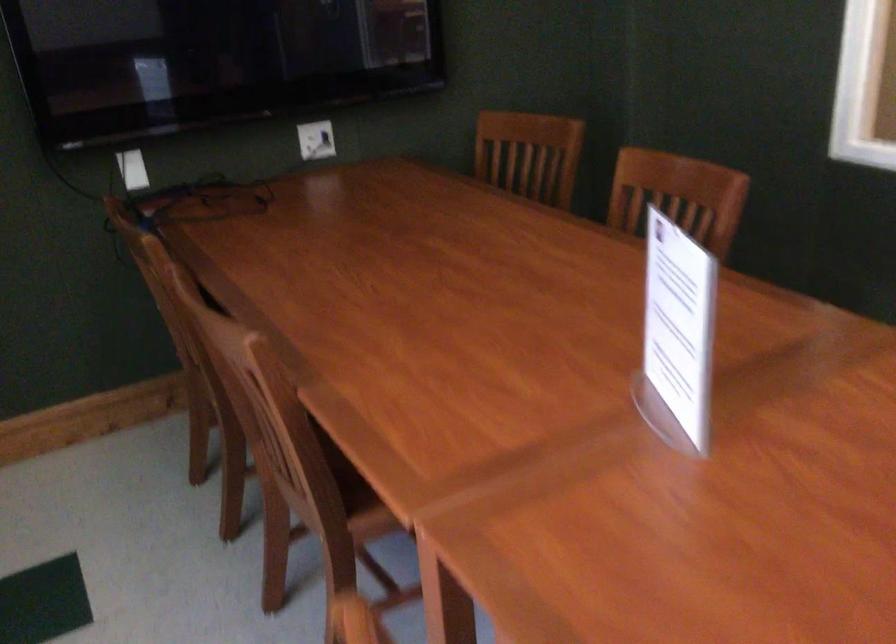
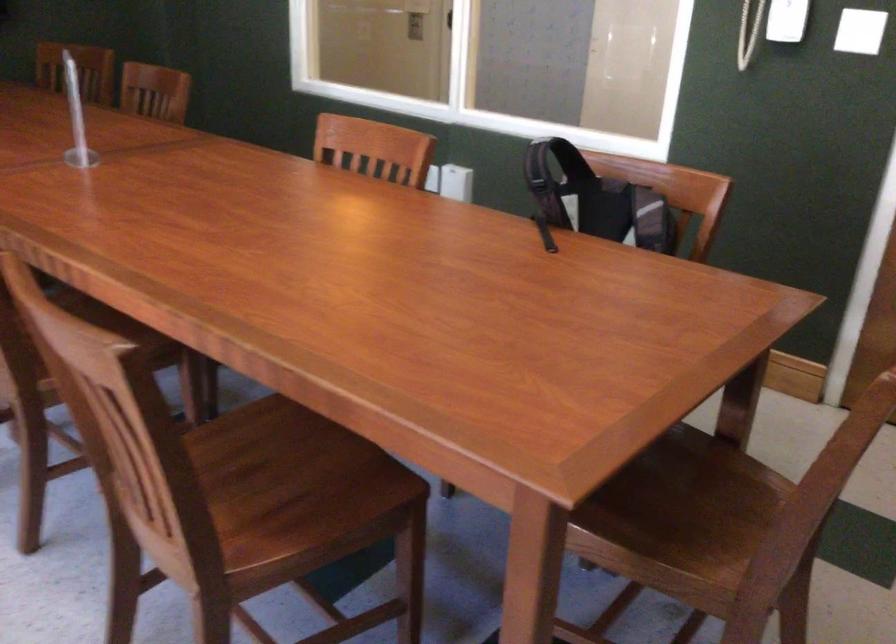
Question: What movement of the cameraman would produce the second image?

Choices:
 (A) Left
 (B) Right
 (C) Forward
 (D) Backward

Answer: (D)